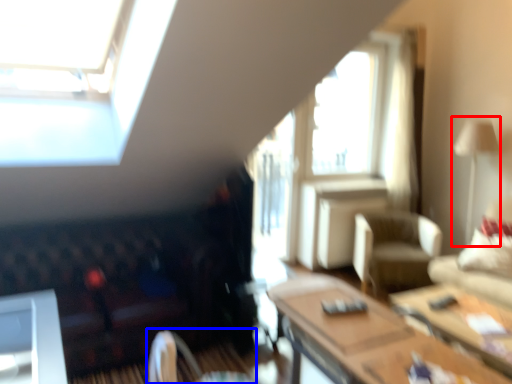
Question: Which of the following is the closest to the observer, lamp (highlighted by a red box) or swivel chair (highlighted by a blue box)?

Choices:
 (A) lamp
 (B) swivel chair

Answer: (B)